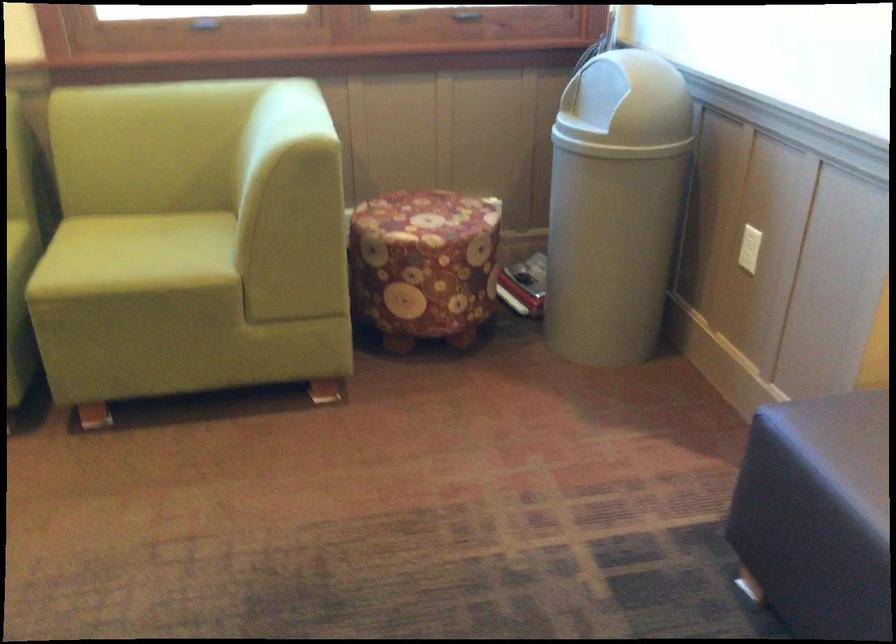
Where would you push the trash can swing lid? Please return your answer as a coordinate pair (x, y).

(598, 99)